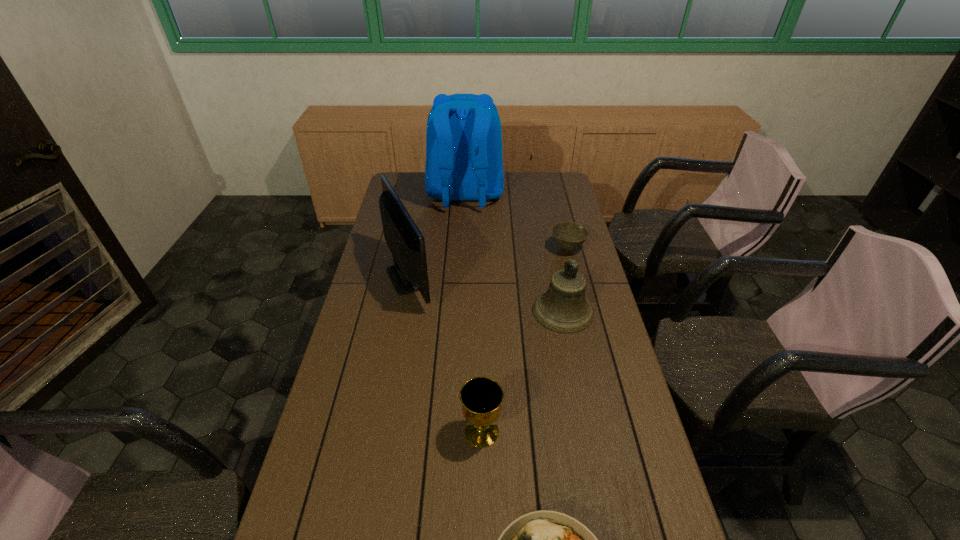
Identify the location of blank region between the fourth tallest object and the fourth shortest object. Image resolution: width=960 pixels, height=540 pixels. (522, 372).

Where is `free space between the second nearest object and the fourth shortest object`? This screenshot has width=960, height=540. free space between the second nearest object and the fourth shortest object is located at coordinates (522, 372).

Where is `empty location between the farthest object and the fourth shortest object`? The height and width of the screenshot is (540, 960). empty location between the farthest object and the fourth shortest object is located at coordinates (514, 253).

In order to click on free space between the farthest object and the bowl in this screenshot , I will do `click(516, 221)`.

Locate an element on the screen. vacant region between the tallest object and the fourth shortest object is located at coordinates (514, 253).

At what (x,y) coordinates should I click in order to perform the action: click on free space between the fourth tallest object and the bowl. Please return your answer as a coordinate pair (x, y). The height and width of the screenshot is (540, 960). Looking at the image, I should click on (524, 340).

The image size is (960, 540). Identify the location of unoccupied position between the second tallest object and the fourth tallest object. (445, 354).

Where is `empty space between the farthest object and the bowl`? empty space between the farthest object and the bowl is located at coordinates (516, 221).

Identify which object is the nearest to the bowl. Please provide its 2D coordinates. Your answer should be formatted as a tuple, i.e. [(x, y)], where the tuple contains the x and y coordinates of a point satisfying the conditions above.

[(563, 308)]

Locate an element on the screen. This screenshot has height=540, width=960. the fourth closest object to the salad plate is located at coordinates (568, 235).